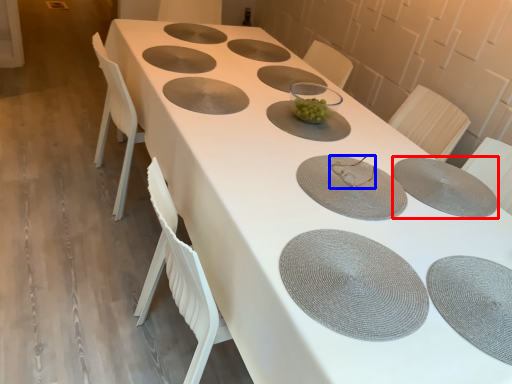
Question: Which object appears closest to the camera in this image, tableware (highlighted by a red box) or tableware (highlighted by a blue box)?

Choices:
 (A) tableware
 (B) tableware

Answer: (A)